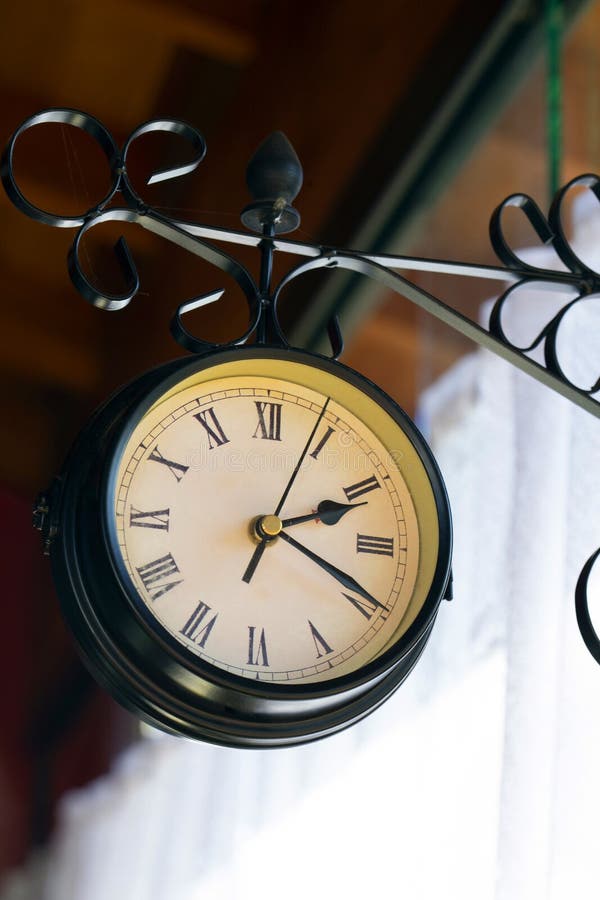
This screenshot has width=600, height=900. What are the coordinates of `clock face` in the screenshot? It's located at (243, 490).